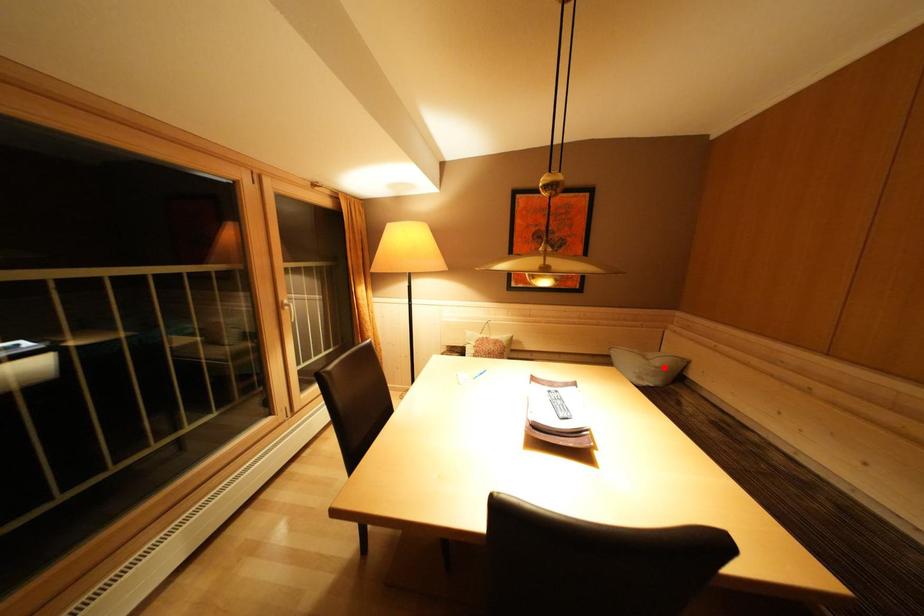
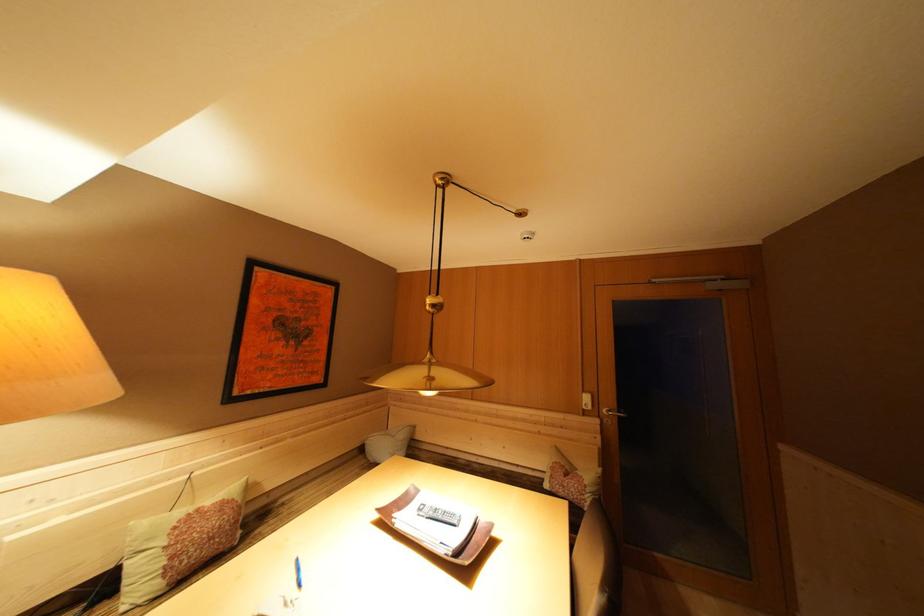
Where in the second image is the point corresponding to the highlighted location from the first image?

(408, 440)